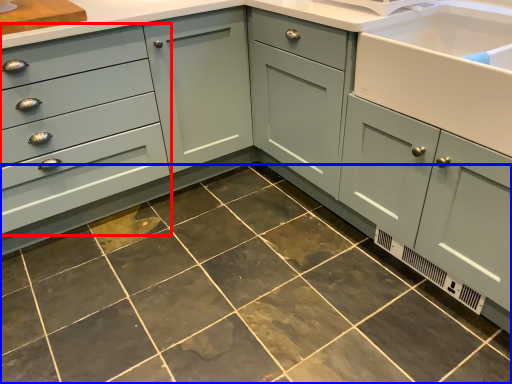
Question: Which of the following is the closest to the observer, drawer (highlighted by a red box) or ceramic tile (highlighted by a blue box)?

Choices:
 (A) drawer
 (B) ceramic tile

Answer: (B)